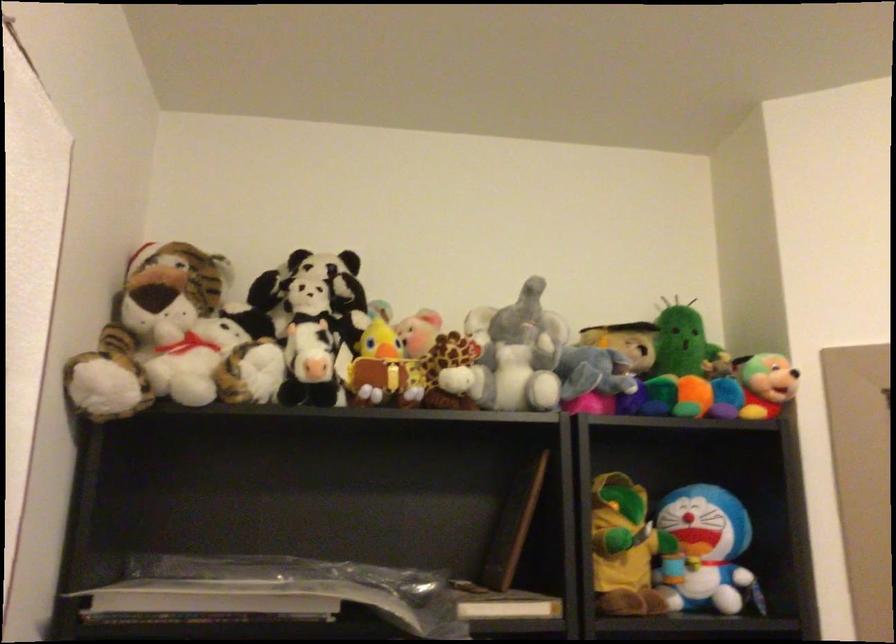
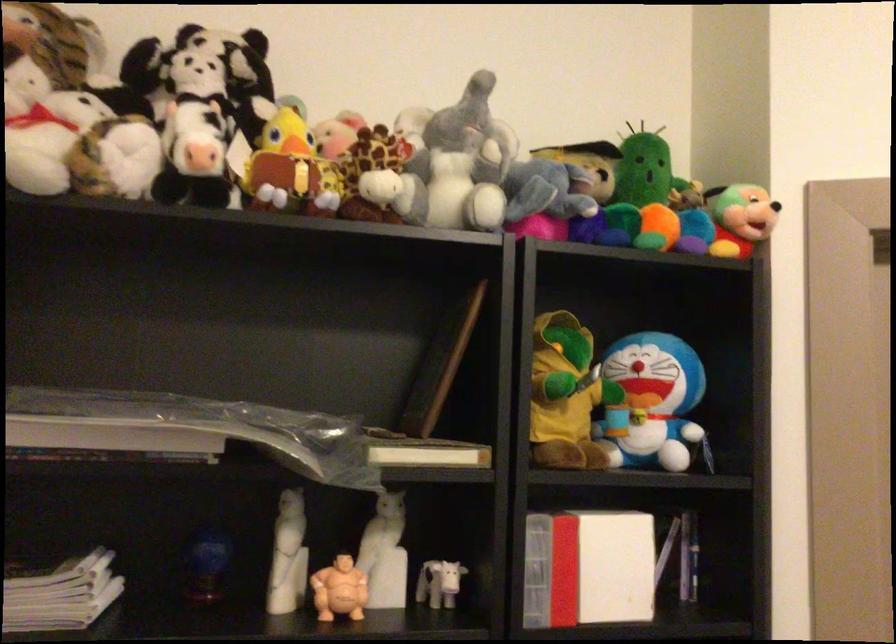
The point at [521,355] is marked in the first image. Where is the corresponding point in the second image?

(459, 165)